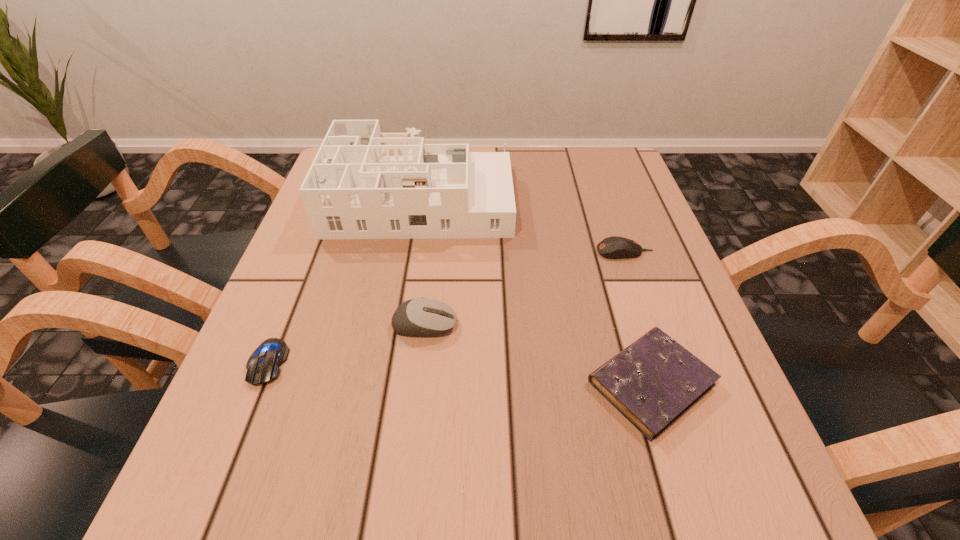
In order to click on vacant region at the near edge of the desktop in this screenshot , I will do `click(540, 497)`.

The height and width of the screenshot is (540, 960). In the image, there is a desktop. What are the coordinates of `blank space at the left edge` in the screenshot? It's located at (315, 294).

At what (x,y) coordinates should I click in order to perform the action: click on free space at the right edge. Please return your answer as a coordinate pair (x, y). The height and width of the screenshot is (540, 960). Looking at the image, I should click on (596, 237).

Locate an element on the screen. free space at the near left corner of the desktop is located at coordinates (188, 502).

Where is `free space at the far right corner`? free space at the far right corner is located at coordinates (616, 151).

You are a GUI agent. You are given a task and a screenshot of the screen. Output one action in this format:
    pyautogui.click(x=<x>, y=<y>)
    Task: Click on the unoccupied position between the farthest computer mouse and the second computer mouse from right to left
    
    Given the screenshot: What is the action you would take?
    pyautogui.click(x=524, y=288)

In order to click on free point between the leftmost computer mouse and the tallest object in this screenshot , I will do point(344,280).

At what (x,y) coordinates should I click in order to perform the action: click on vacant area that lies between the farthest object and the fourth shortest object. Please return your answer as a coordinate pair (x, y). This screenshot has height=540, width=960. Looking at the image, I should click on (422, 261).

Image resolution: width=960 pixels, height=540 pixels. Identify the location of blank region between the leftmost computer mouse and the tallest computer mouse. (346, 344).

Image resolution: width=960 pixels, height=540 pixels. I want to click on unoccupied area between the third tallest object and the farthest object, so click(x=523, y=225).